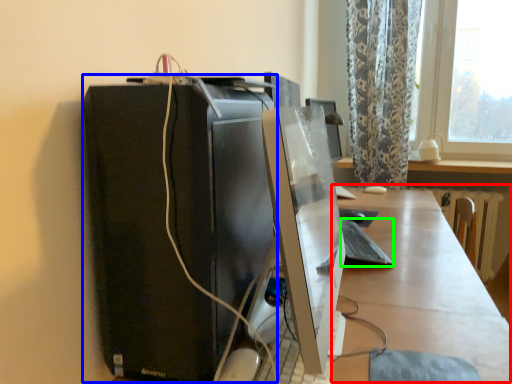
Question: Which object is the closest to the table (highlighted by a red box)? Choose among these: computer tower (highlighted by a blue box) or computer keyboard (highlighted by a green box).

Choices:
 (A) computer tower
 (B) computer keyboard

Answer: (B)